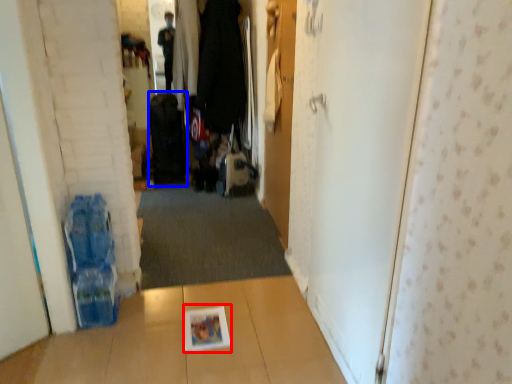
Question: Which of the following is the closest to the observer, magazine (highlighted by a red box) or luggage (highlighted by a blue box)?

Choices:
 (A) magazine
 (B) luggage

Answer: (A)